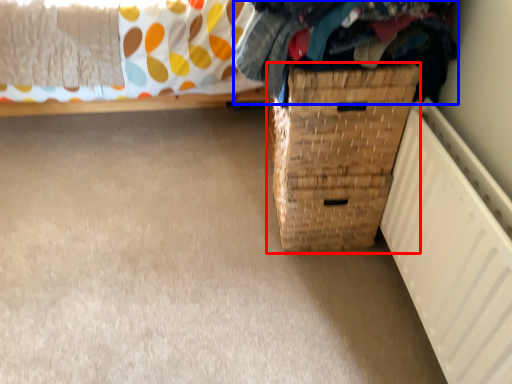
Question: Among these objects, which one is nearest to the camera, basket container (highlighted by a red box) or clothing (highlighted by a blue box)?

Choices:
 (A) basket container
 (B) clothing

Answer: (B)